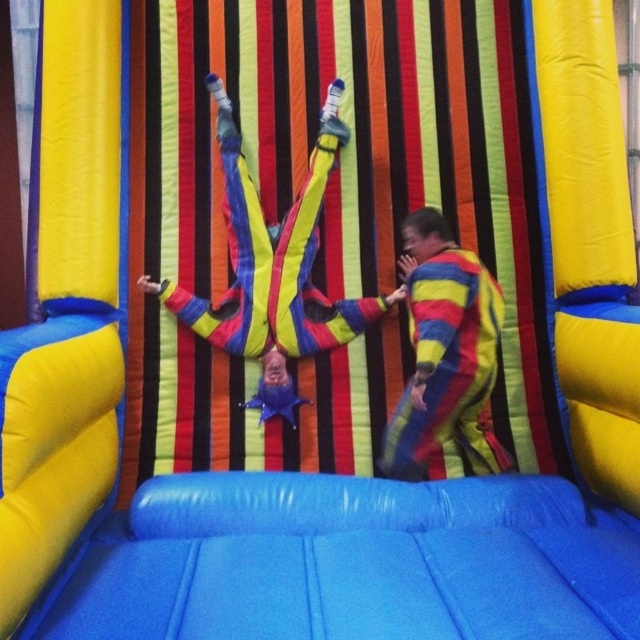
In the scene shown: You are a photographer inside the bouncy castle and want to capture both the striped fabric pants at center and the striped fabric clown at center in a single frame. Which object should you focus on first to ensure both are in the shot?

You should focus on the striped fabric pants at center first since it is taller than the striped fabric clown at center, ensuring the entire height of the pants is captured while the clown will naturally fit within the frame.

You are an observer inside the bouncy castle. You see the striped fabric pants at center and the striped fabric clown at center. Which object is positioned higher in the scene?

The striped fabric pants at center is above the striped fabric clown at center, so the striped fabric pants at center is positioned higher in the scene.

You are trying to locate the striped fabric pants at center in the image. According to the coordinates provided, where exactly would you find them?

The striped fabric pants at center are located at coordinates point (275, 260).